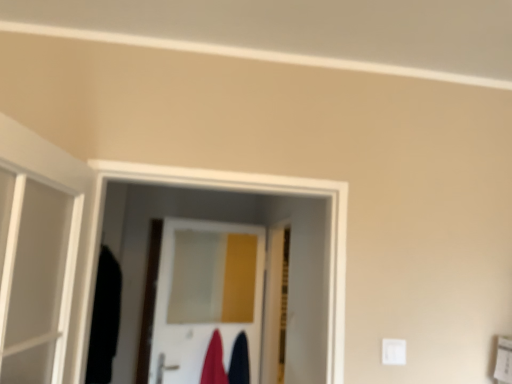
Question: Is white glossy door at center, the first door in the left-to-right sequence, smaller than velvet-like red robe at center, the 1th robe positioned from the left?

Choices:
 (A) yes
 (B) no

Answer: (B)

Question: Is white glossy door at center, which is counted as the 2th door, starting from the right, to the left of velvet-like red robe at center, acting as the 2th robe starting from the right, from the viewer's perspective?

Choices:
 (A) no
 (B) yes

Answer: (B)

Question: Is the position of white glossy door at center, the first door in the left-to-right sequence, less distant than that of velvet-like red robe at center, acting as the 2th robe starting from the right?

Choices:
 (A) yes
 (B) no

Answer: (A)

Question: Are white glossy door at center, which is counted as the 2th door, starting from the right, and velvet-like red robe at center, the 1th robe positioned from the left, far apart?

Choices:
 (A) yes
 (B) no

Answer: (B)

Question: Considering the relative sizes of white glossy door at center, which is counted as the 2th door, starting from the right, and velvet-like red robe at center, acting as the 2th robe starting from the right, in the image provided, is white glossy door at center, which is counted as the 2th door, starting from the right, bigger than velvet-like red robe at center, acting as the 2th robe starting from the right,?

Choices:
 (A) yes
 (B) no

Answer: (A)

Question: Which is correct: wooden door at center, which ranks as the 1th door in right-to-left order, is inside velvet dark blue robe at center, placed as the 1th robe when sorted from right to left, or outside of it?

Choices:
 (A) outside
 (B) inside

Answer: (A)

Question: Considering their positions, is wooden door at center, which ranks as the 1th door in right-to-left order, located in front of or behind velvet dark blue robe at center, placed as the 1th robe when sorted from right to left?

Choices:
 (A) behind
 (B) front

Answer: (B)

Question: From their relative heights in the image, would you say wooden door at center, which appears as the second door when viewed from the left, is taller or shorter than velvet dark blue robe at center, which is counted as the 2th robe, starting from the left?

Choices:
 (A) short
 (B) tall

Answer: (B)

Question: From a real-world perspective, is wooden door at center, which appears as the second door when viewed from the left, above or below velvet dark blue robe at center, which is counted as the 2th robe, starting from the left?

Choices:
 (A) above
 (B) below

Answer: (A)

Question: From their relative heights in the image, would you say velvet dark blue robe at center, placed as the 1th robe when sorted from right to left, is taller or shorter than velvet-like red robe at center, the 1th robe positioned from the left?

Choices:
 (A) tall
 (B) short

Answer: (B)

Question: In the image, is velvet dark blue robe at center, placed as the 1th robe when sorted from right to left, positioned in front of or behind velvet-like red robe at center, the 1th robe positioned from the left?

Choices:
 (A) front
 (B) behind

Answer: (B)

Question: Considering the relative positions of velvet dark blue robe at center, which is counted as the 2th robe, starting from the left, and velvet-like red robe at center, the 1th robe positioned from the left, in the image provided, is velvet dark blue robe at center, which is counted as the 2th robe, starting from the left, to the left or to the right of velvet-like red robe at center, the 1th robe positioned from the left,?

Choices:
 (A) right
 (B) left

Answer: (A)

Question: From a real-world perspective, is velvet dark blue robe at center, placed as the 1th robe when sorted from right to left, above or below velvet-like red robe at center, the 1th robe positioned from the left?

Choices:
 (A) below
 (B) above

Answer: (A)

Question: Looking at the image, does white glossy door at center, which is counted as the 2th door, starting from the right, seem bigger or smaller compared to velvet-like red robe at center, the 1th robe positioned from the left?

Choices:
 (A) big
 (B) small

Answer: (A)

Question: Is white glossy door at center, the first door in the left-to-right sequence, spatially inside velvet-like red robe at center, acting as the 2th robe starting from the right, or outside of it?

Choices:
 (A) outside
 (B) inside

Answer: (A)